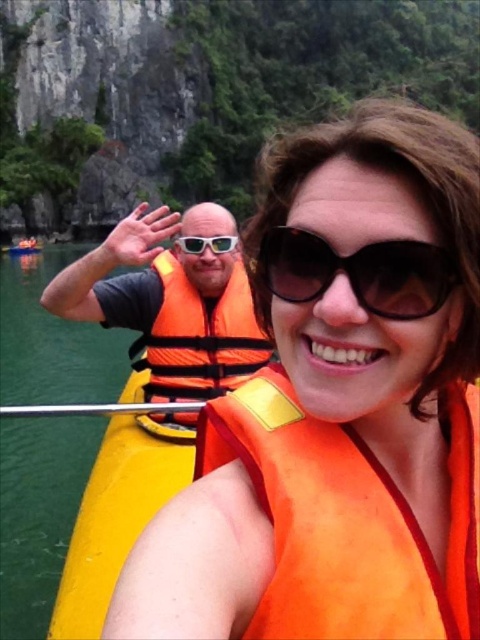
Question: Based on their relative distances, which object is nearer to the orange fabric life vest at center?

Choices:
 (A) yellow plastic paddle at center
 (B) orange fabric life jacket at left
 (C) white plastic goggles at center
 (D) black plastic sunglasses at center

Answer: (D)

Question: Is orange life vest at center to the left of black plastic sunglasses at center from the viewer's perspective?

Choices:
 (A) no
 (B) yes

Answer: (B)

Question: Can you confirm if orange life vest at left is smaller than white plastic goggles at center?

Choices:
 (A) yes
 (B) no

Answer: (B)

Question: Among these points, which one is nearest to the camera?

Choices:
 (A) (8, 412)
 (B) (186, 243)

Answer: (A)

Question: Observing the image, what is the correct spatial positioning of orange fabric life jacket at left in reference to black plastic sunglasses at center?

Choices:
 (A) left
 (B) right

Answer: (A)

Question: Among these points, which one is farthest from the camera?

Choices:
 (A) (380, 612)
 (B) (115, 248)
 (C) (205, 355)

Answer: (B)